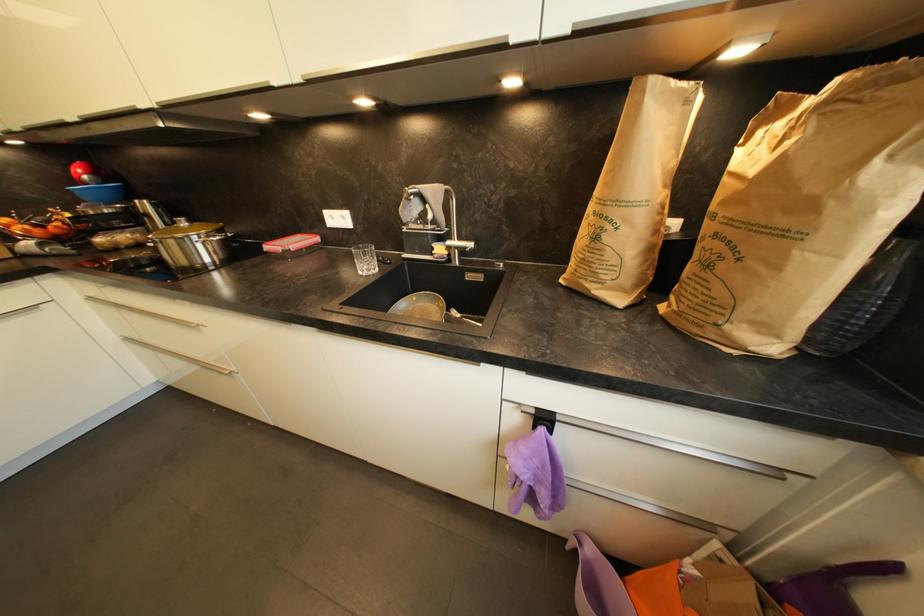
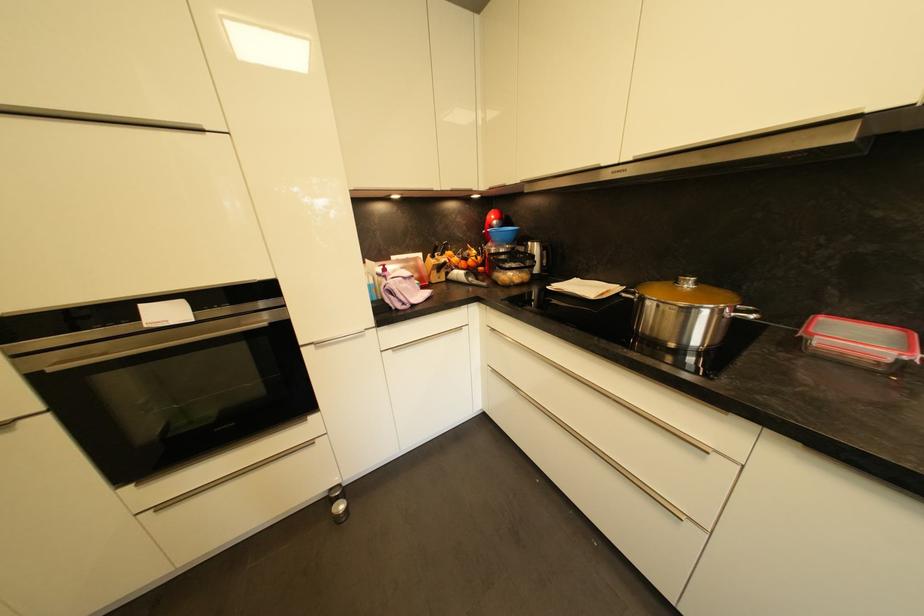
Where in the second image is the point corresponding to pixel 44 233 from the first image?

(468, 265)